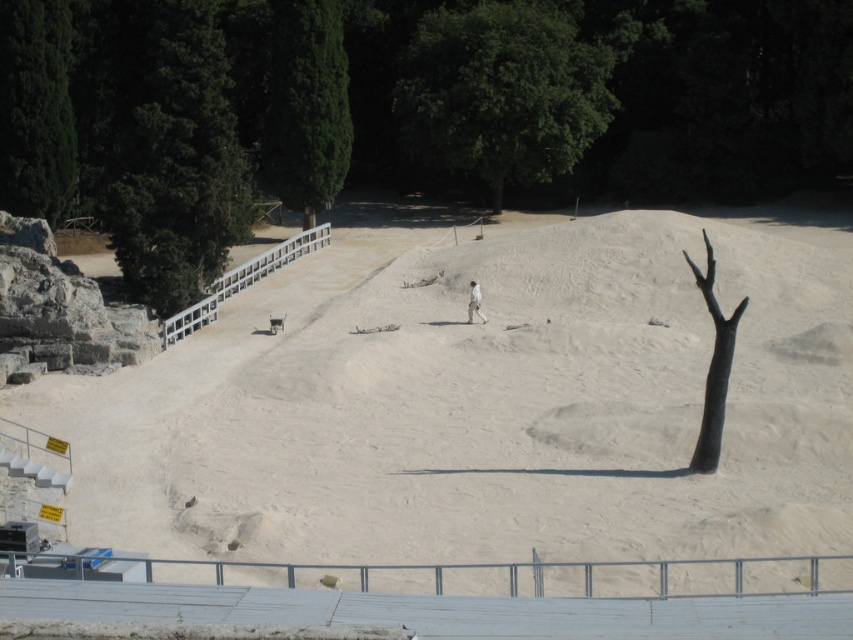
Question: Among these objects, which one is farthest from the camera?

Choices:
 (A) white plastic fence at upper center
 (B) green leafy tree at upper center
 (C) green textured tree at upper center

Answer: (B)

Question: Considering the real-world distances, which object is closest to the dark green leafy tree at upper left?

Choices:
 (A) white matte skier at center
 (B) black matte tree at right
 (C) metallic silver fence at lower center

Answer: (A)

Question: Is green leafy tree at upper center thinner than white matte skier at center?

Choices:
 (A) yes
 (B) no

Answer: (B)

Question: Which object is positioned farthest from the black matte tree at right?

Choices:
 (A) metallic silver fence at lower center
 (B) green leafy tree at upper center
 (C) green textured tree at upper center

Answer: (B)

Question: Does green leafy tree at upper center have a lesser width compared to white matte skier at center?

Choices:
 (A) no
 (B) yes

Answer: (A)

Question: Is dark green leafy tree at upper left positioned behind green leafy tree at upper center?

Choices:
 (A) no
 (B) yes

Answer: (A)